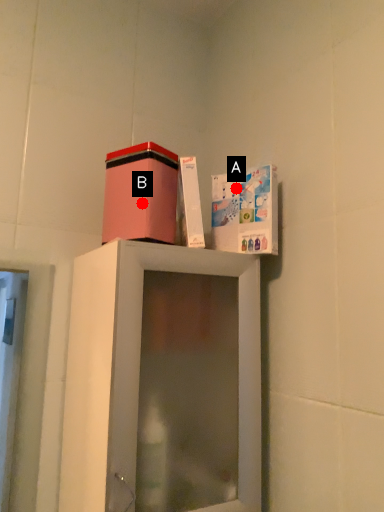
Question: Two points are circled on the image, labeled by A and B beside each circle. Which of the following is the farthest from the observer?

Choices:
 (A) A is further
 (B) B is further

Answer: (A)